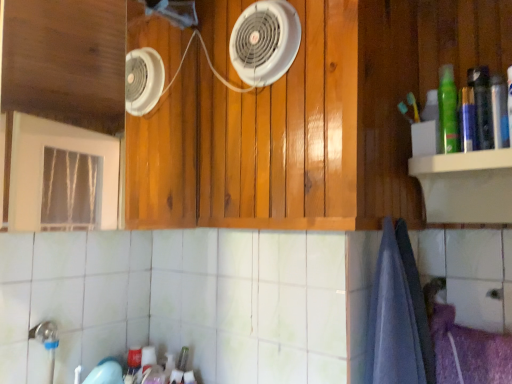
Describe the element at coordinates (254, 140) in the screenshot. I see `wooden cabinet at center` at that location.

Locate an element on the screen. The image size is (512, 384). white plastic fan at upper center is located at coordinates (265, 42).

Is blue cotton bath towel at lower right positioned with its back to wooden cabinet at center?

No, blue cotton bath towel at lower right is not facing the opposite direction of wooden cabinet at center.

Considering the points (380, 255) and (298, 109), which point is behind, point (380, 255) or point (298, 109)?

Point (298, 109)

Is blue cotton bath towel at lower right next to wooden cabinet at center and touching it?

No, blue cotton bath towel at lower right is not beside wooden cabinet at center.

Between blue cotton bath towel at lower right and wooden cabinet at center, which one has smaller size?

Smaller between the two is wooden cabinet at center.

Can you confirm if green matte bottle at upper right is taller than wooden cabinet at center?

Incorrect, the height of green matte bottle at upper right is not larger of that of wooden cabinet at center.

Is green matte bottle at upper right not near wooden cabinet at center?

green matte bottle at upper right is near wooden cabinet at center, not far away.

From a real-world perspective, which object rests below the other?

green matte bottle at upper right, from a real-world perspective.

Between point (448, 133) and point (340, 128), which one is positioned behind?

The point (448, 133) is more distant.

Is blue cotton bath towel at lower right turned away from white plastic fan at upper center?

That's not correct — blue cotton bath towel at lower right is not looking away from white plastic fan at upper center.

Does blue cotton bath towel at lower right contain white plastic fan at upper center?

That's incorrect, white plastic fan at upper center is not inside blue cotton bath towel at lower right.

From a real-world perspective, which object stands above the other?

white plastic fan at upper center, from a real-world perspective.

Considering the relative sizes of green matte bottle at upper right and white plastic fan at upper center in the image provided, is green matte bottle at upper right shorter than white plastic fan at upper center?

Yes.

Which is in front, green matte bottle at upper right or white plastic fan at upper center?

Positioned in front is green matte bottle at upper right.

Is green matte bottle at upper right in contact with white plastic fan at upper center?

No.

Based on their sizes in the image, would you say green matte bottle at upper right is bigger or smaller than white plastic fan at upper center?

green matte bottle at upper right is smaller than white plastic fan at upper center.

Could you tell me if wooden cabinet at center is turned towards white plastic fan at upper center?

Yes, wooden cabinet at center is facing white plastic fan at upper center.

From the image's perspective, is wooden cabinet at center over white plastic fan at upper center?

No.

Does wooden cabinet at center come behind white plastic fan at upper center?

No, it is not.

Can we say wooden cabinet at center lies outside white plastic fan at upper center?

wooden cabinet at center lies outside white plastic fan at upper center's area.

Identify the location of bath towel directly beneath the wooden cabinet at center (from a real-world perspective). The height and width of the screenshot is (384, 512). (398, 316).

Based on the photo, from a real-world perspective, is wooden cabinet at center below blue cotton bath towel at lower right?

Incorrect, from a real-world perspective, wooden cabinet at center is higher than blue cotton bath towel at lower right.

Can you tell me how much wooden cabinet at center and blue cotton bath towel at lower right differ in facing direction?

The angle between the facing direction of wooden cabinet at center and the facing direction of blue cotton bath towel at lower right is 90.2 degrees.

Can you confirm if wooden cabinet at center is positioned to the right of blue cotton bath towel at lower right?

No.

Considering their positions, is wooden cabinet at center located in front of or behind green matte bottle at upper right?

Visually, wooden cabinet at center is located in front of green matte bottle at upper right.

From the image's perspective, does wooden cabinet at center appear higher than green matte bottle at upper right?

Yes.

Is wooden cabinet at center outside of green matte bottle at upper right?

That's correct, wooden cabinet at center is outside of green matte bottle at upper right.

At what (x,y) coordinates should I click in order to perform the action: click on bath towel located underneath the wooden cabinet at center (from a real-world perspective). Please return your answer as a coordinate pair (x, y). Looking at the image, I should click on (398, 316).

Find the location of a particular element. Image resolution: width=512 pixels, height=384 pixels. bottle located behind the wooden cabinet at center is located at coordinates (448, 110).

When comparing their distances from wooden cabinet at center, does blue cotton bath towel at lower right or white plastic fan at upper center seem closer?

white plastic fan at upper center.

Which object lies nearer to the anchor point blue cotton bath towel at lower right, green matte bottle at upper right or white plastic fan at upper center?

Among the two, green matte bottle at upper right is located nearer to blue cotton bath towel at lower right.

Which object lies nearer to the anchor point wooden cabinet at center, white plastic fan at upper center or blue cotton bath towel at lower right?

white plastic fan at upper center.

Which object lies nearer to the anchor point blue cotton bath towel at lower right, wooden cabinet at center or green matte bottle at upper right?

green matte bottle at upper right lies closer to blue cotton bath towel at lower right than the other object.

Considering their positions, is white plastic fan at upper center positioned further to wooden cabinet at center than green matte bottle at upper right?

Based on the image, green matte bottle at upper right appears to be further to wooden cabinet at center.

Considering their positions, is white plastic fan at upper center positioned closer to blue cotton bath towel at lower right than green matte bottle at upper right?

Based on the image, green matte bottle at upper right appears to be nearer to blue cotton bath towel at lower right.

When comparing their distances from white plastic fan at upper center, does blue cotton bath towel at lower right or green matte bottle at upper right seem further?

blue cotton bath towel at lower right is positioned further to the anchor white plastic fan at upper center.

When comparing their distances from green matte bottle at upper right, does wooden cabinet at center or white plastic fan at upper center seem further?

Based on the image, wooden cabinet at center appears to be further to green matte bottle at upper right.

Find the location of a particular element. bottle between wooden cabinet at center and blue cotton bath towel at lower right from top to bottom is located at coordinates (448, 110).

Locate an element on the screen. bottle between white plastic fan at upper center and blue cotton bath towel at lower right vertically is located at coordinates (448, 110).

The width and height of the screenshot is (512, 384). Identify the location of home appliance between wooden cabinet at center and green matte bottle at upper right from left to right. (265, 42).

Where is `cabinetry between white plastic fan at upper center and blue cotton bath towel at lower right vertically`? Image resolution: width=512 pixels, height=384 pixels. cabinetry between white plastic fan at upper center and blue cotton bath towel at lower right vertically is located at coordinates (254, 140).